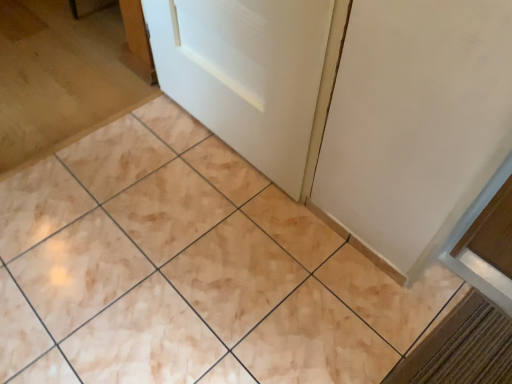
Identify the location of vacant area that is in front of white glossy door at upper center. Image resolution: width=512 pixels, height=384 pixels. (206, 218).